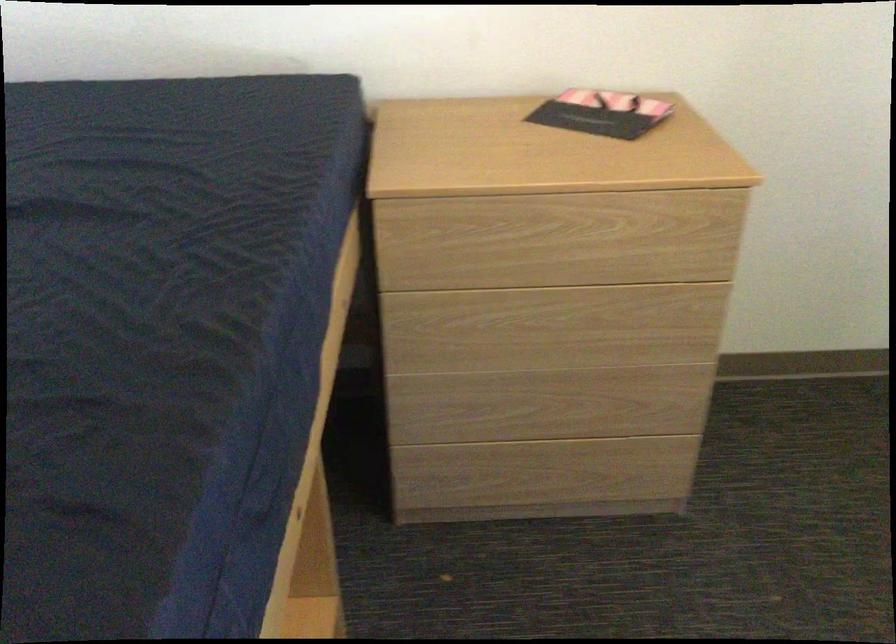
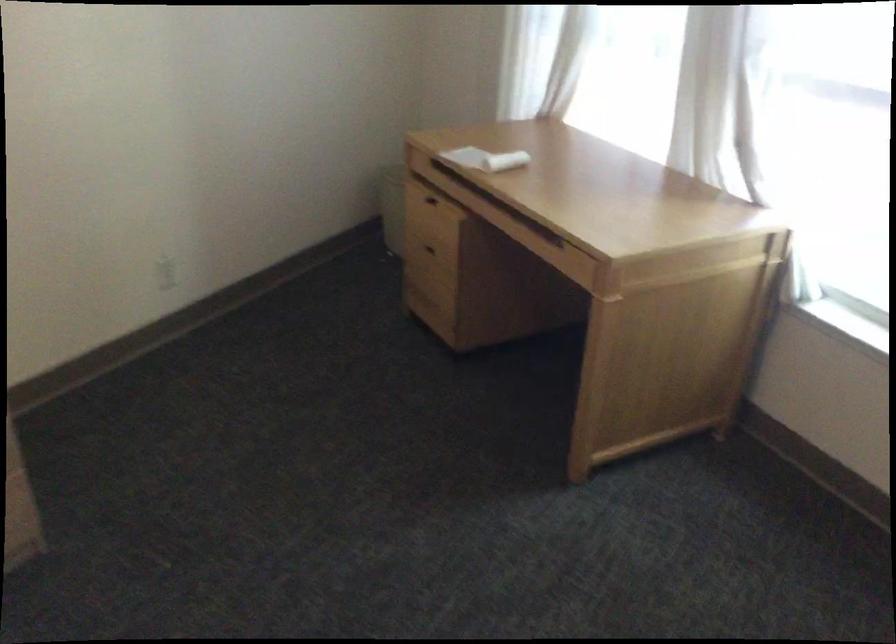
Question: How did the camera likely rotate?

Choices:
 (A) Left
 (B) Right
 (C) Up
 (D) Down

Answer: (B)